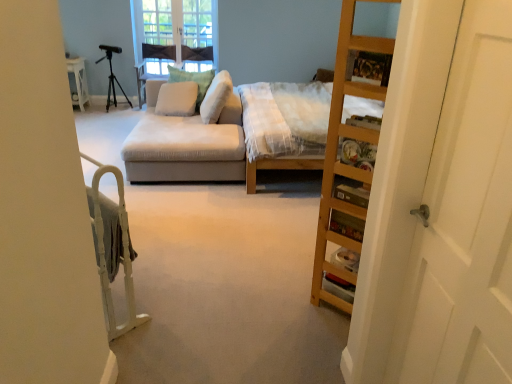
I want to click on vacant area that lies between suede-like beige couch at center and white wood bed frame at left, so click(176, 225).